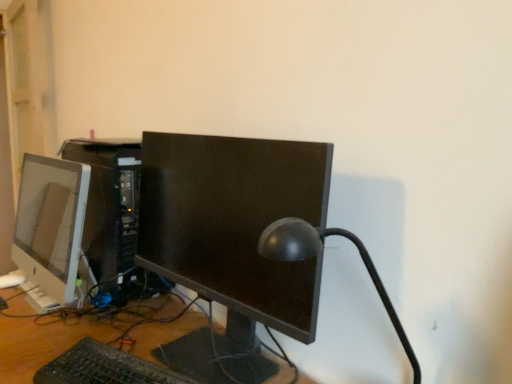
What is the approximate height of matte black monitor at center, the second computer monitor from the left?

matte black monitor at center, the second computer monitor from the left, is 21.87 inches in height.

The height and width of the screenshot is (384, 512). Find the location of `satin black lamp at center`. satin black lamp at center is located at coordinates (317, 254).

The height and width of the screenshot is (384, 512). Find the location of `satin white monitor at left, arranged as the first computer monitor when viewed from the left`. satin white monitor at left, arranged as the first computer monitor when viewed from the left is located at coordinates (50, 229).

Where is `black plastic keyboard at lower center`? black plastic keyboard at lower center is located at coordinates (104, 367).

Describe the element at coordinates (104, 367) in the screenshot. I see `black plastic keyboard at lower center` at that location.

This screenshot has width=512, height=384. What are the coordinates of `satin black computer tower at center` in the screenshot? It's located at (109, 205).

This screenshot has width=512, height=384. I want to click on wooden desk at center, so click(x=42, y=342).

Where is `matte black monitor at center, the second computer monitor from the left`? This screenshot has height=384, width=512. matte black monitor at center, the second computer monitor from the left is located at coordinates (234, 232).

Based on the photo, which object is positioned more to the left, satin black computer tower at center or black plastic keyboard at lower center?

From the viewer's perspective, satin black computer tower at center appears more on the left side.

Is satin black computer tower at center turned away from black plastic keyboard at lower center?

That's not correct — satin black computer tower at center is not looking away from black plastic keyboard at lower center.

From the image's perspective, between satin black computer tower at center and black plastic keyboard at lower center, who is located below?

black plastic keyboard at lower center is shown below in the image.

How distant is satin black computer tower at center from satin black lamp at center?

satin black computer tower at center is 27.64 inches from satin black lamp at center.

Where is `table lamp lying on the right of satin black computer tower at center`? Image resolution: width=512 pixels, height=384 pixels. table lamp lying on the right of satin black computer tower at center is located at coordinates (317, 254).

Does satin black computer tower at center turn towards satin black lamp at center?

No, satin black computer tower at center is not oriented towards satin black lamp at center.

From a real-world perspective, is satin black lamp at center positioned under satin black computer tower at center based on gravity?

Yes, from a real-world perspective, satin black lamp at center is under satin black computer tower at center.

From the image's perspective, between satin black lamp at center and satin black computer tower at center, who is located below?

satin black lamp at center is shown below in the image.

Do you think satin black lamp at center is within satin black computer tower at center, or outside of it?

satin black lamp at center exists outside the volume of satin black computer tower at center.

Is satin white monitor at left, arranged as the first computer monitor when viewed from the left, oriented towards satin black computer tower at center?

Yes, satin white monitor at left, arranged as the first computer monitor when viewed from the left, is oriented towards satin black computer tower at center.

Between satin white monitor at left, arranged as the first computer monitor when viewed from the left, and satin black computer tower at center, which one has smaller size?

With smaller size is satin white monitor at left, arranged as the first computer monitor when viewed from the left.

Is satin white monitor at left, arranged as the first computer monitor when viewed from the left, positioned far away from satin black computer tower at center?

Yes, satin white monitor at left, arranged as the first computer monitor when viewed from the left, and satin black computer tower at center are located far from each other.

In the image, is satin white monitor at left, which is counted as the second computer monitor, starting from the right, on the left side or the right side of satin black computer tower at center?

Clearly, satin white monitor at left, which is counted as the second computer monitor, starting from the right, is on the left of satin black computer tower at center in the image.

Does satin white monitor at left, arranged as the first computer monitor when viewed from the left, turn towards wooden desk at center?

No, satin white monitor at left, arranged as the first computer monitor when viewed from the left, is not oriented towards wooden desk at center.

From a real-world perspective, is satin white monitor at left, arranged as the first computer monitor when viewed from the left, positioned above or below wooden desk at center?

satin white monitor at left, arranged as the first computer monitor when viewed from the left, is situated higher than wooden desk at center in the real world.

Would you say satin white monitor at left, arranged as the first computer monitor when viewed from the left, is outside wooden desk at center?

That's correct, satin white monitor at left, arranged as the first computer monitor when viewed from the left, is outside of wooden desk at center.

Find the location of a particular element. The height and width of the screenshot is (384, 512). desk below the satin white monitor at left, which is counted as the second computer monitor, starting from the right (from a real-world perspective) is located at coordinates (42, 342).

From a real-world perspective, is satin black lamp at center physically located above or below matte black monitor at center, which ranks as the first computer monitor in right-to-left order?

satin black lamp at center is situated lower than matte black monitor at center, which ranks as the first computer monitor in right-to-left order, in the real world.

Do you think satin black lamp at center is within matte black monitor at center, the second computer monitor from the left, or outside of it?

satin black lamp at center lies outside matte black monitor at center, the second computer monitor from the left.

Is satin black lamp at center looking in the opposite direction of matte black monitor at center, which ranks as the first computer monitor in right-to-left order?

No, satin black lamp at center is not facing away from matte black monitor at center, which ranks as the first computer monitor in right-to-left order.

Which is more to the left, satin black lamp at center or matte black monitor at center, the second computer monitor from the left?

matte black monitor at center, the second computer monitor from the left.

What are the coordinates of `computer monitor that is on the left side of satin black computer tower at center` in the screenshot? It's located at (50, 229).

From a real-world perspective, is satin black computer tower at center below satin white monitor at left, arranged as the first computer monitor when viewed from the left?

Actually, satin black computer tower at center is physically above satin white monitor at left, arranged as the first computer monitor when viewed from the left, in the real world.

Could you tell me if satin black computer tower at center is facing satin white monitor at left, arranged as the first computer monitor when viewed from the left?

Yes, satin black computer tower at center is oriented towards satin white monitor at left, arranged as the first computer monitor when viewed from the left.

I want to click on computer tower on the left of black plastic keyboard at lower center, so click(109, 205).

Image resolution: width=512 pixels, height=384 pixels. Find the location of `computer tower behind the satin black lamp at center`. computer tower behind the satin black lamp at center is located at coordinates (109, 205).

Looking at this image, looking at the image, which one is located further to satin white monitor at left, which is counted as the second computer monitor, starting from the right, satin black lamp at center or wooden desk at center?

satin black lamp at center is further to satin white monitor at left, which is counted as the second computer monitor, starting from the right.

When comparing their distances from wooden desk at center, does black plastic keyboard at lower center or satin white monitor at left, arranged as the first computer monitor when viewed from the left, seem further?

satin white monitor at left, arranged as the first computer monitor when viewed from the left.

Which object lies further to the anchor point wooden desk at center, satin white monitor at left, arranged as the first computer monitor when viewed from the left, or black plastic keyboard at lower center?

Among the two, satin white monitor at left, arranged as the first computer monitor when viewed from the left, is located further to wooden desk at center.

When comparing their distances from matte black monitor at center, which ranks as the first computer monitor in right-to-left order, does black plastic keyboard at lower center or satin black computer tower at center seem further?

satin black computer tower at center is positioned further to the anchor matte black monitor at center, which ranks as the first computer monitor in right-to-left order.

Based on their spatial positions, is wooden desk at center or satin black lamp at center further from black plastic keyboard at lower center?

satin black lamp at center is further to black plastic keyboard at lower center.

When comparing their distances from wooden desk at center, does black plastic keyboard at lower center or matte black monitor at center, which ranks as the first computer monitor in right-to-left order, seem further?

matte black monitor at center, which ranks as the first computer monitor in right-to-left order, is further to wooden desk at center.

Based on their spatial positions, is wooden desk at center or matte black monitor at center, the second computer monitor from the left, closer to satin white monitor at left, which is counted as the second computer monitor, starting from the right?

Based on the image, wooden desk at center appears to be nearer to satin white monitor at left, which is counted as the second computer monitor, starting from the right.

From the image, which object appears to be nearer to black plastic keyboard at lower center, satin black lamp at center or satin black computer tower at center?

The object closer to black plastic keyboard at lower center is satin black lamp at center.

Identify the location of desk located between satin black lamp at center and satin black computer tower at center in the depth direction. This screenshot has width=512, height=384. (42, 342).

Find the location of `computer monitor situated between wooden desk at center and satin black lamp at center from left to right`. computer monitor situated between wooden desk at center and satin black lamp at center from left to right is located at coordinates (234, 232).

The image size is (512, 384). What are the coordinates of `computer keyboard located between wooden desk at center and satin black computer tower at center in the depth direction` in the screenshot? It's located at (104, 367).

Find the location of a particular element. The image size is (512, 384). computer keyboard between satin white monitor at left, which is counted as the second computer monitor, starting from the right, and matte black monitor at center, the second computer monitor from the left, from left to right is located at coordinates (104, 367).